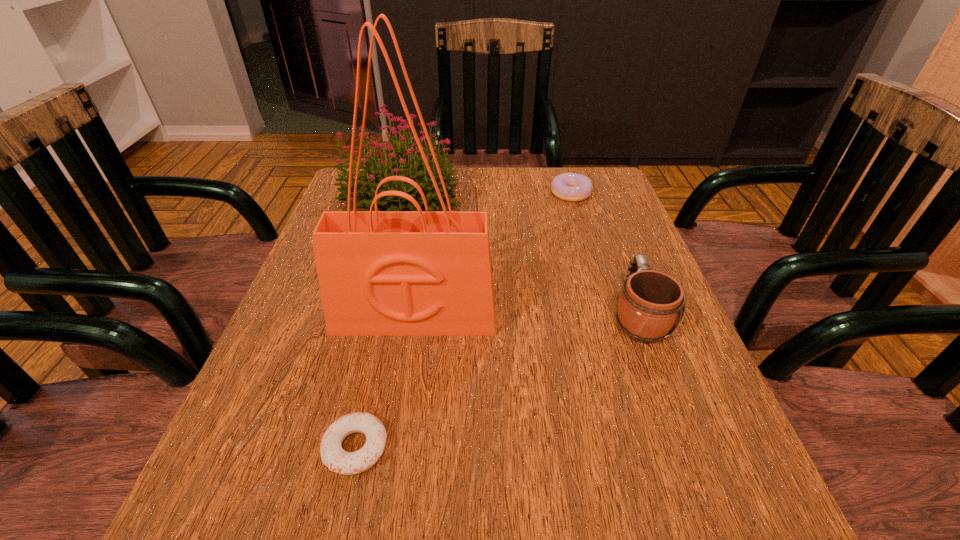
Where is `vacant space located on the side of the mug with the handle`? The width and height of the screenshot is (960, 540). vacant space located on the side of the mug with the handle is located at coordinates (590, 188).

At what (x,y) coordinates should I click in order to perform the action: click on vacant space located on the side of the mug with the handle. Please return your answer as a coordinate pair (x, y). The width and height of the screenshot is (960, 540). Looking at the image, I should click on (593, 195).

The height and width of the screenshot is (540, 960). Find the location of `free space located 0.330m on the left of the fourth tallest object`. free space located 0.330m on the left of the fourth tallest object is located at coordinates (424, 193).

Identify the location of vacant space situated on the back of the shorter doughnut. This screenshot has height=540, width=960. (379, 342).

Where is `bouquet that is at the far edge`? The width and height of the screenshot is (960, 540). bouquet that is at the far edge is located at coordinates (396, 163).

This screenshot has width=960, height=540. Find the location of `doughnut located at the far edge`. doughnut located at the far edge is located at coordinates (572, 187).

I want to click on tote bag that is at the left edge, so click(381, 273).

The image size is (960, 540). What are the coordinates of `bouquet located at the left edge` in the screenshot? It's located at (396, 163).

Where is `doughnut positioned at the left edge`? Image resolution: width=960 pixels, height=540 pixels. doughnut positioned at the left edge is located at coordinates (333, 456).

Where is `mug at the right edge`? This screenshot has width=960, height=540. mug at the right edge is located at coordinates pos(651,302).